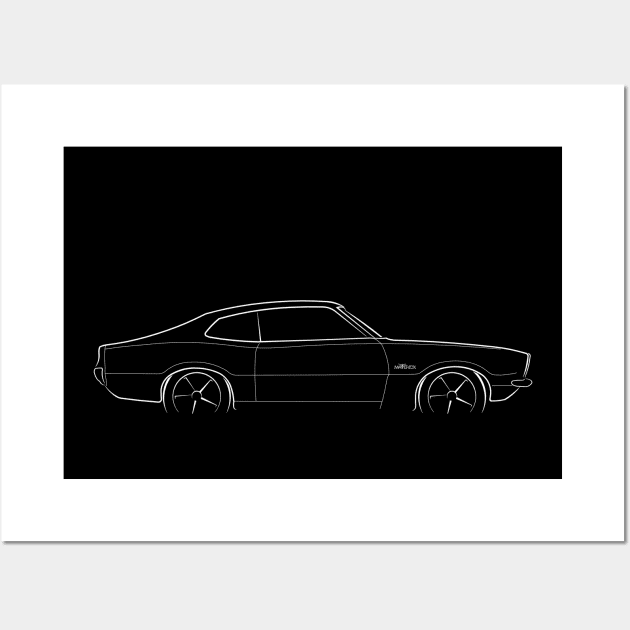
Find the location of `window`. window is located at coordinates (294, 315), (239, 329), (370, 329).